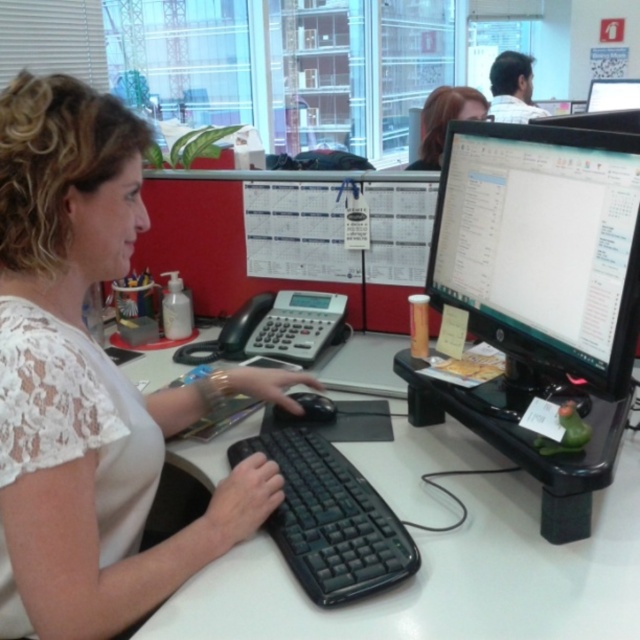
Question: Can you confirm if matte black monitor at center is smaller than black matte mouse at center?

Choices:
 (A) no
 (B) yes

Answer: (A)

Question: Based on their relative distances, which object is farther from the matte black monitor at upper right?

Choices:
 (A) white lace blouse at center
 (B) black plastic keyboard at center
 (C) black plastic computer desk at center
 (D) blonde hair at upper center

Answer: (A)

Question: Estimate the real-world distances between objects in this image. Which object is farther from the matte black monitor at upper right?

Choices:
 (A) blonde hair at upper center
 (B) white lace blouse at center
 (C) black plastic keyboard at center
 (D) black plastic computer desk at center

Answer: (B)

Question: Is white lace blouse at center bigger than black plastic keyboard at center?

Choices:
 (A) no
 (B) yes

Answer: (B)

Question: Can you confirm if black plastic computer desk at center is thinner than matte black monitor at center?

Choices:
 (A) yes
 (B) no

Answer: (B)

Question: Which object appears farthest from the camera in this image?

Choices:
 (A) white lace blouse at center
 (B) black plastic keyboard at center
 (C) black plastic computer desk at center

Answer: (B)